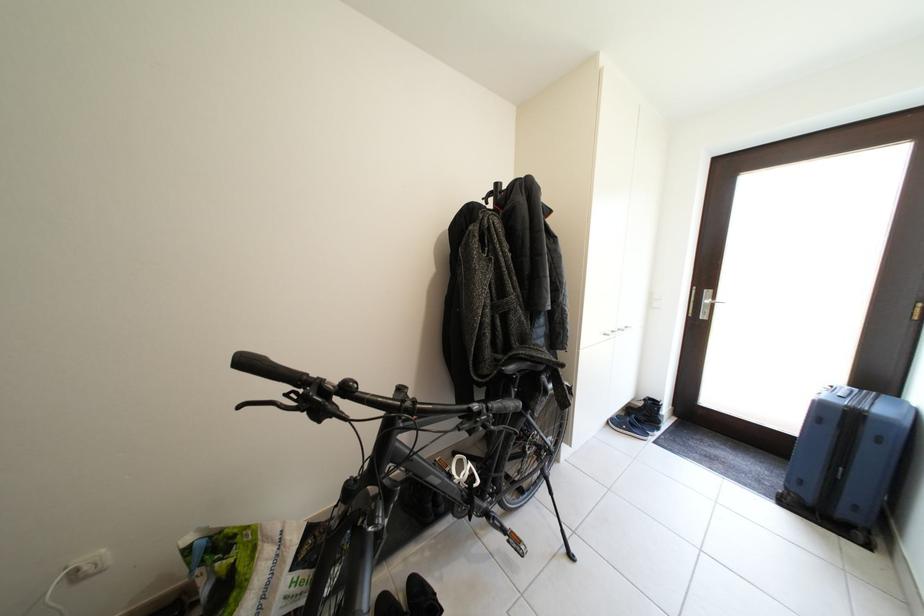
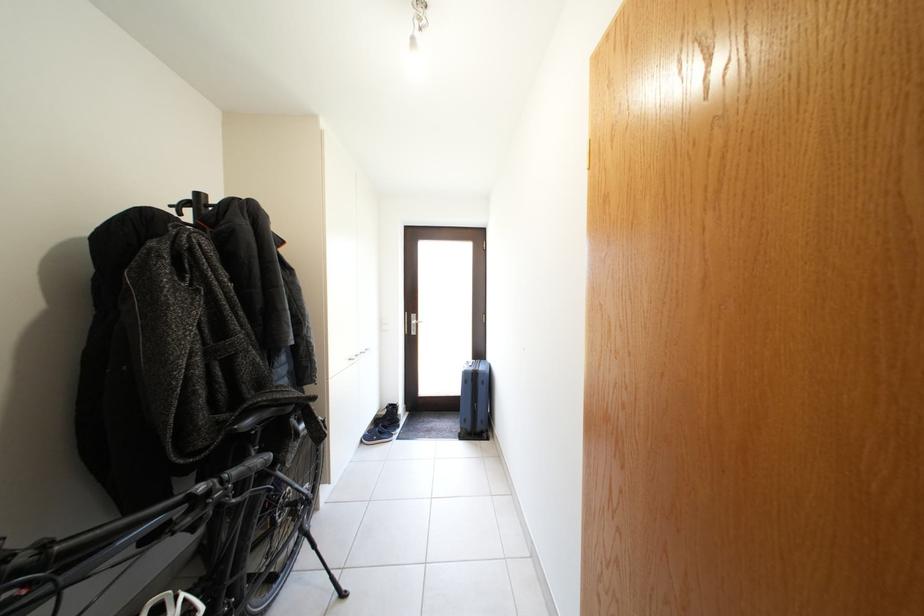
The point at (504, 411) is marked in the first image. Where is the corresponding point in the second image?

(242, 477)